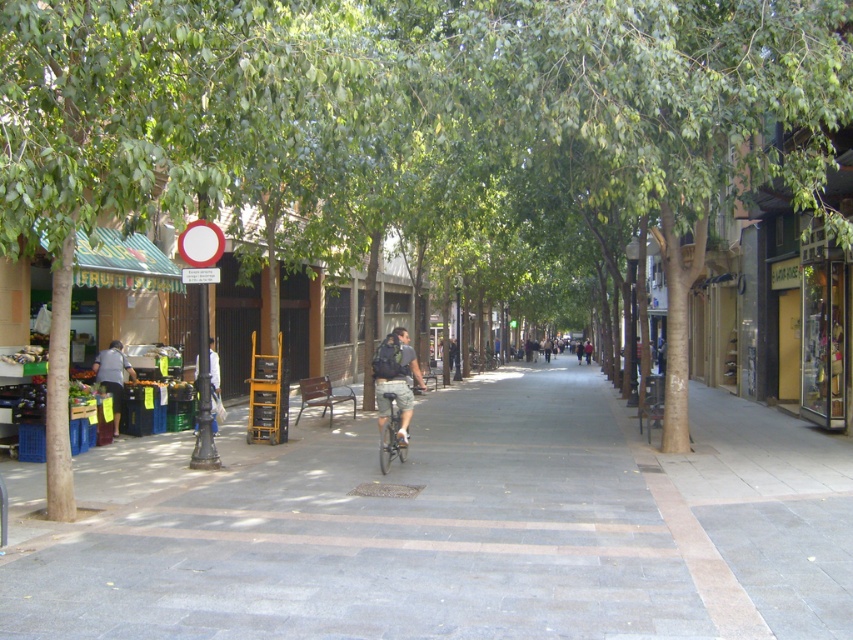
Between point (111, 344) and point (215, 394), which one is positioned behind?

The point (215, 394) is more distant.

This screenshot has height=640, width=853. Describe the element at coordinates (112, 376) in the screenshot. I see `dark gray shirt at left` at that location.

Where is `dark gray shirt at left`? dark gray shirt at left is located at coordinates (112, 376).

Find the location of a particular element. dark gray shirt at left is located at coordinates (112, 376).

Who is positioned more to the left, silver metallic bicycle at center or white fabric bag at center?

white fabric bag at center

Does silver metallic bicycle at center appear under white fabric bag at center?

Indeed, silver metallic bicycle at center is positioned under white fabric bag at center.

Is point (396, 445) farther from viewer compared to point (218, 388)?

No, it is in front of (218, 388).

What are the coordinates of `silver metallic bicycle at center` in the screenshot? It's located at (390, 428).

Between point (245, 634) and point (383, 436), which one is positioned behind?

Point (383, 436)

Image resolution: width=853 pixels, height=640 pixels. What do you see at coordinates (450, 525) in the screenshot? I see `gray concrete sidewalk at center` at bounding box center [450, 525].

This screenshot has width=853, height=640. I want to click on gray concrete sidewalk at center, so click(x=450, y=525).